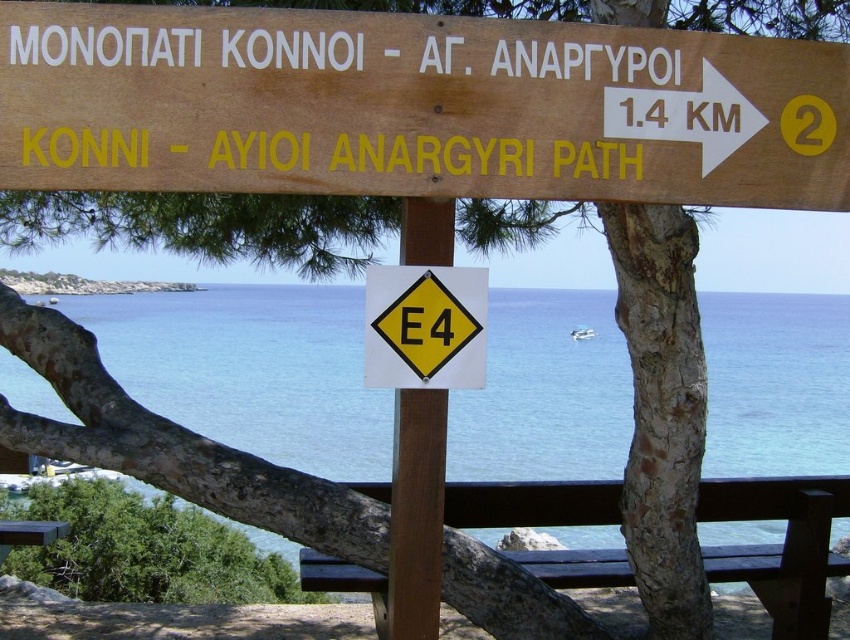
Between point (822, 176) and point (486, 387), which one is positioned in front?

Positioned in front is point (822, 176).

Which is in front, point (437, 147) or point (0, 365)?

Point (437, 147)

The height and width of the screenshot is (640, 850). Identify the location of yellow diamond sign at upper center. (416, 108).

Does point (371, 387) come closer to viewer compared to point (51, 529)?

That is True.

Who is more forward, (400, 316) or (34, 545)?

Positioned in front is point (400, 316).

I want to click on yellow plastic diamond at center, so [425, 326].

Is brown wooden bench at center to the right of yellow plastic diamond at center from the viewer's perspective?

Result: Correct, you'll find brown wooden bench at center to the right of yellow plastic diamond at center.

Does brown wooden bench at center come in front of yellow plastic diamond at center?

No, it is behind yellow plastic diamond at center.

Where is `brown wooden bench at center`? brown wooden bench at center is located at coordinates (779, 545).

This screenshot has width=850, height=640. What are the coordinates of `brown wooden bench at center` in the screenshot? It's located at (779, 545).